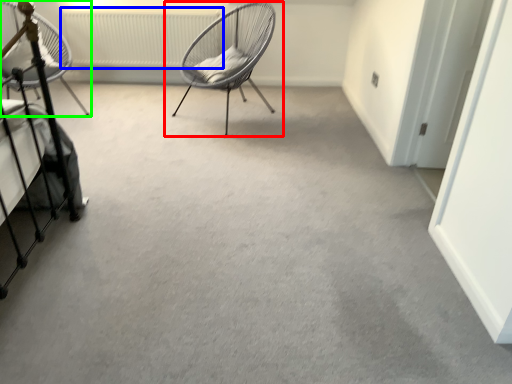
Question: Which object is positioned closest to chair (highlighted by a red box)? Select from radiator (highlighted by a blue box) and chair (highlighted by a green box).

Choices:
 (A) radiator
 (B) chair

Answer: (A)